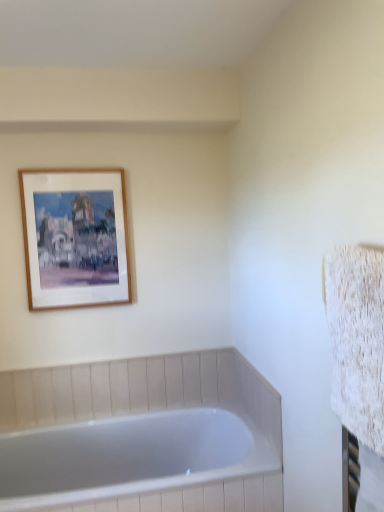
Question: Would you say wooden frame at upper left is part of white glossy bathtub at lower left's contents?

Choices:
 (A) no
 (B) yes

Answer: (A)

Question: Does white glossy bathtub at lower left have a lesser width compared to wooden frame at upper left?

Choices:
 (A) no
 (B) yes

Answer: (A)

Question: Does white glossy bathtub at lower left lie behind wooden frame at upper left?

Choices:
 (A) yes
 (B) no

Answer: (B)

Question: Is white glossy bathtub at lower left facing away from wooden frame at upper left?

Choices:
 (A) no
 (B) yes

Answer: (A)

Question: Is white glossy bathtub at lower left next to wooden frame at upper left?

Choices:
 (A) no
 (B) yes

Answer: (A)

Question: Is white glossy bathtub at lower left taller than wooden frame at upper left?

Choices:
 (A) yes
 (B) no

Answer: (B)

Question: Is wooden frame at upper left with white glossy bathtub at lower left?

Choices:
 (A) no
 (B) yes

Answer: (A)

Question: Is wooden frame at upper left looking in the opposite direction of white glossy bathtub at lower left?

Choices:
 (A) yes
 (B) no

Answer: (B)

Question: Considering the relative sizes of wooden frame at upper left and white glossy bathtub at lower left in the image provided, is wooden frame at upper left taller than white glossy bathtub at lower left?

Choices:
 (A) yes
 (B) no

Answer: (A)

Question: Considering the relative positions of wooden frame at upper left and white glossy bathtub at lower left in the image provided, is wooden frame at upper left behind white glossy bathtub at lower left?

Choices:
 (A) yes
 (B) no

Answer: (A)

Question: Does wooden frame at upper left appear on the right side of white glossy bathtub at lower left?

Choices:
 (A) no
 (B) yes

Answer: (A)

Question: Is wooden frame at upper left outside of white glossy bathtub at lower left?

Choices:
 (A) no
 (B) yes

Answer: (B)

Question: From the image's perspective, is wooden frame at upper left above or below white glossy bathtub at lower left?

Choices:
 (A) below
 (B) above

Answer: (B)